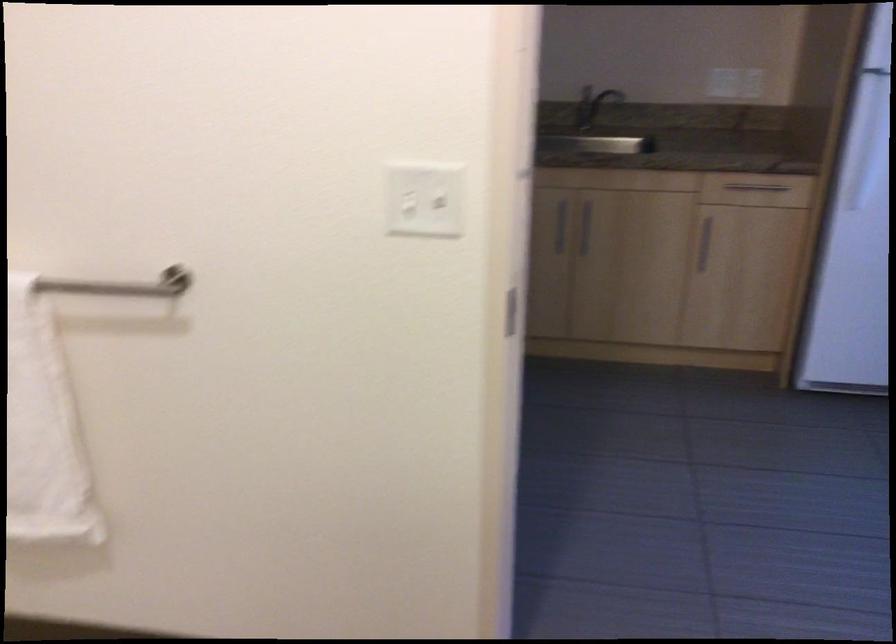
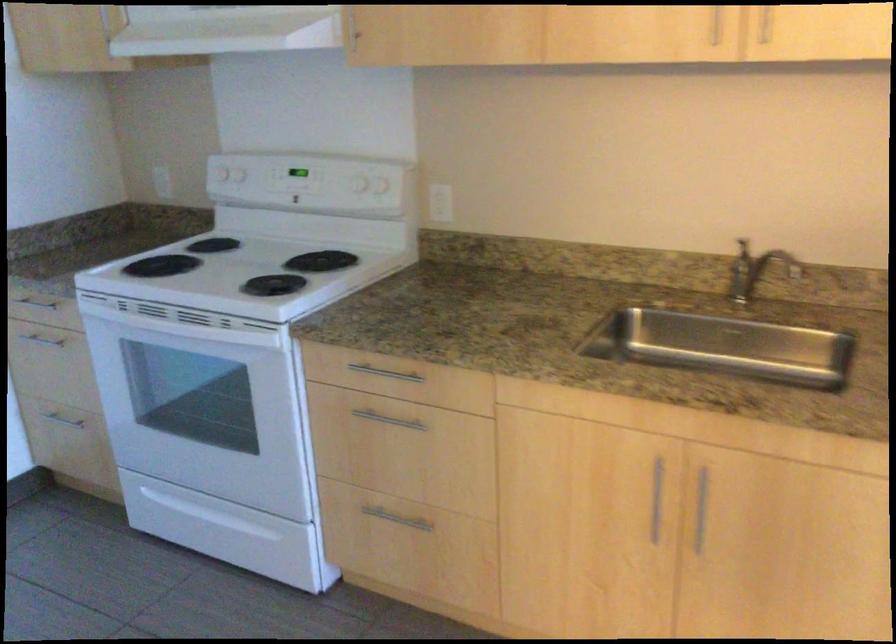
What movement of the cameraman would produce the second image?

The movement direction of the cameraman is right, forward.